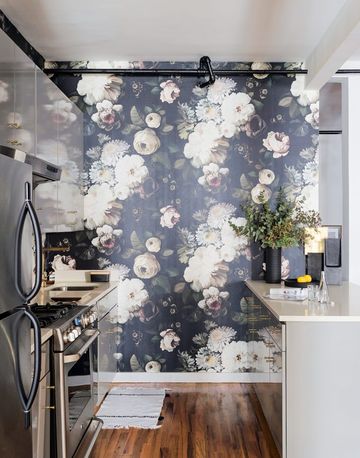
The width and height of the screenshot is (360, 458). Identify the location of floor. (204, 444).